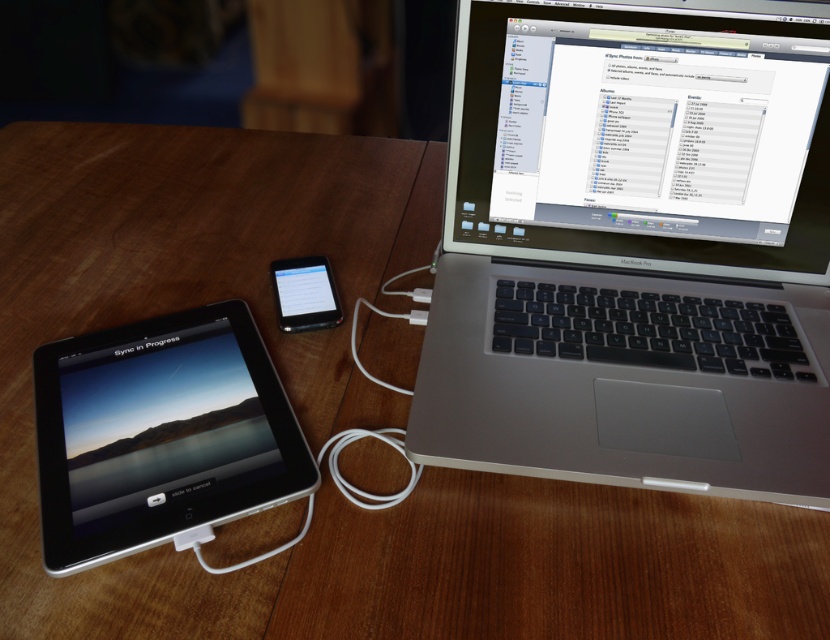
Does silver/black plastic laptop at right appear on the left side of black glossy tablet at lower left?

No, silver/black plastic laptop at right is not to the left of black glossy tablet at lower left.

You are a GUI agent. You are given a task and a screenshot of the screen. Output one action in this format:
    pyautogui.click(x=<x>, y=<y>)
    Task: Click on the silver/black plastic laptop at right
    The height and width of the screenshot is (640, 830).
    Given the screenshot: What is the action you would take?
    pyautogui.click(x=633, y=252)

Is point (740, 212) farther from viewer compared to point (291, 296)?

No, (740, 212) is closer to viewer.

Between point (511, 225) and point (290, 284), which one is positioned in front?

Point (290, 284)

This screenshot has width=830, height=640. I want to click on silver/black plastic laptop at right, so click(633, 252).

Between black glossy tablet at lower left and satin black ipod at center, which one is positioned higher?

satin black ipod at center is higher up.

Measure the distance from black glossy tablet at lower left to satin black ipod at center.

5.20 inches

Between point (120, 467) and point (290, 324), which one is positioned in front?

Point (120, 467)

Identify the location of black glossy tablet at lower left. (159, 433).